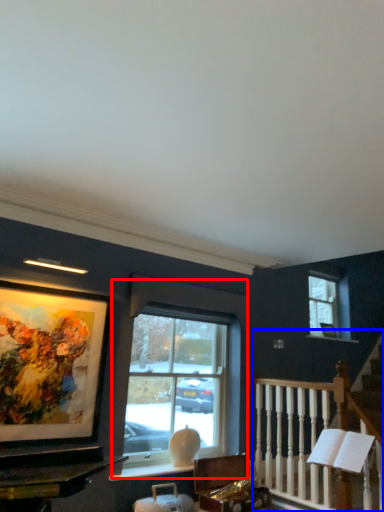
Question: Which of the following is the farthest to the observer, window (highlighted by a red box) or rail (highlighted by a blue box)?

Choices:
 (A) window
 (B) rail

Answer: (A)